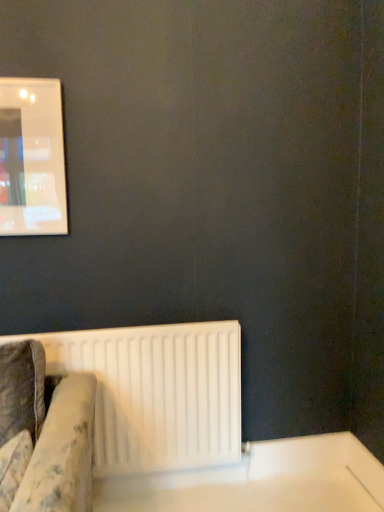
Question: Would you say white plastic radiator at lower left is to the left or to the right of white glossy table at lower right in the picture?

Choices:
 (A) right
 (B) left

Answer: (B)

Question: In terms of width, does white plastic radiator at lower left look wider or thinner when compared to white glossy table at lower right?

Choices:
 (A) thin
 (B) wide

Answer: (A)

Question: From a real-world perspective, is white plastic radiator at lower left physically located above or below white glossy table at lower right?

Choices:
 (A) below
 (B) above

Answer: (B)

Question: Based on their sizes in the image, would you say white glossy table at lower right is bigger or smaller than white plastic radiator at lower left?

Choices:
 (A) small
 (B) big

Answer: (A)

Question: Considering the positions of white glossy table at lower right and white plastic radiator at lower left in the image, is white glossy table at lower right wider or thinner than white plastic radiator at lower left?

Choices:
 (A) thin
 (B) wide

Answer: (B)

Question: In terms of height, does white glossy table at lower right look taller or shorter compared to white plastic radiator at lower left?

Choices:
 (A) short
 (B) tall

Answer: (A)

Question: Considering the positions of point (301, 509) and point (74, 362), is point (301, 509) closer or farther from the camera than point (74, 362)?

Choices:
 (A) farther
 (B) closer

Answer: (A)